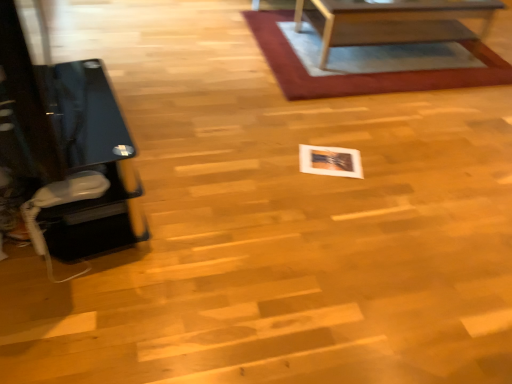
Question: Can you confirm if wooden table at upper center is wider than white glossy photo frame at center?

Choices:
 (A) no
 (B) yes

Answer: (B)

Question: Is wooden table at upper center next to white glossy photo frame at center?

Choices:
 (A) no
 (B) yes

Answer: (A)

Question: Is wooden table at upper center positioned before white glossy photo frame at center?

Choices:
 (A) yes
 (B) no

Answer: (B)

Question: Does wooden table at upper center have a lesser height compared to white glossy photo frame at center?

Choices:
 (A) yes
 (B) no

Answer: (B)

Question: Is wooden table at upper center bigger than white glossy photo frame at center?

Choices:
 (A) no
 (B) yes

Answer: (B)

Question: Is point (25, 77) closer or farther from the camera than point (390, 28)?

Choices:
 (A) farther
 (B) closer

Answer: (B)

Question: Is black glass table at left wider or thinner than wooden table at upper center?

Choices:
 (A) wide
 (B) thin

Answer: (B)

Question: Is black glass table at left spatially inside wooden table at upper center, or outside of it?

Choices:
 (A) outside
 (B) inside

Answer: (A)

Question: From their relative heights in the image, would you say black glass table at left is taller or shorter than wooden table at upper center?

Choices:
 (A) tall
 (B) short

Answer: (A)

Question: In terms of width, does wooden table at upper center look wider or thinner when compared to white glossy photo frame at center?

Choices:
 (A) wide
 (B) thin

Answer: (A)

Question: Considering the relative positions of wooden table at upper center and white glossy photo frame at center in the image provided, is wooden table at upper center to the left or to the right of white glossy photo frame at center?

Choices:
 (A) left
 (B) right

Answer: (B)

Question: Is wooden table at upper center in front of or behind white glossy photo frame at center in the image?

Choices:
 (A) behind
 (B) front

Answer: (A)

Question: Do you think wooden table at upper center is within white glossy photo frame at center, or outside of it?

Choices:
 (A) inside
 (B) outside

Answer: (B)

Question: Is point (482, 36) closer or farther from the camera than point (293, 84)?

Choices:
 (A) farther
 (B) closer

Answer: (A)

Question: From a real-world perspective, relative to rug with woven texture at upper center, is wooden table at upper center vertically above or below?

Choices:
 (A) below
 (B) above

Answer: (B)